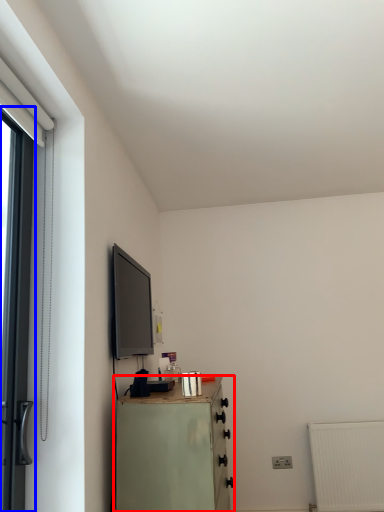
Question: Among these objects, which one is nearest to the camera, chest of drawers (highlighted by a red box) or door (highlighted by a blue box)?

Choices:
 (A) chest of drawers
 (B) door

Answer: (B)